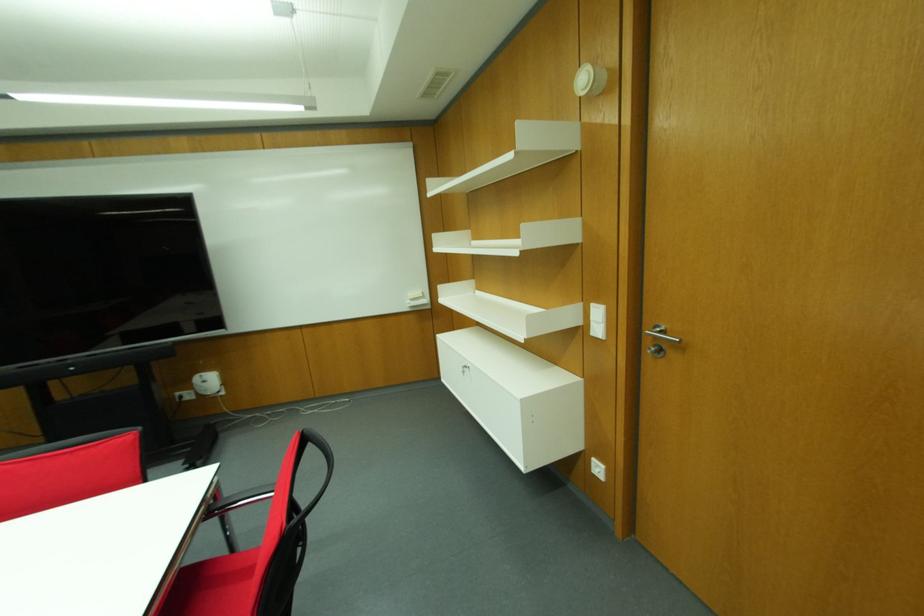
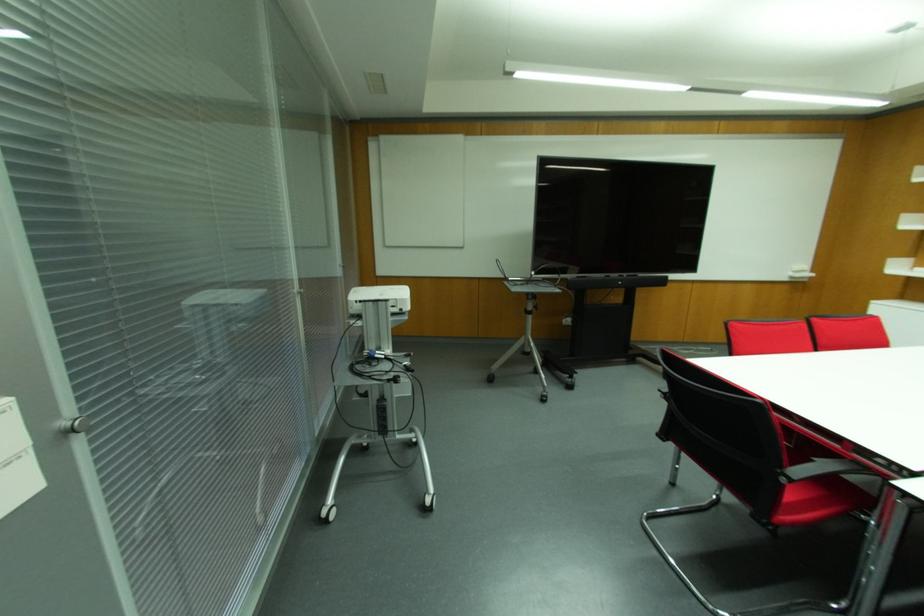
Locate, in the second image, the point that corresponds to point (426, 301) in the first image.

(811, 274)